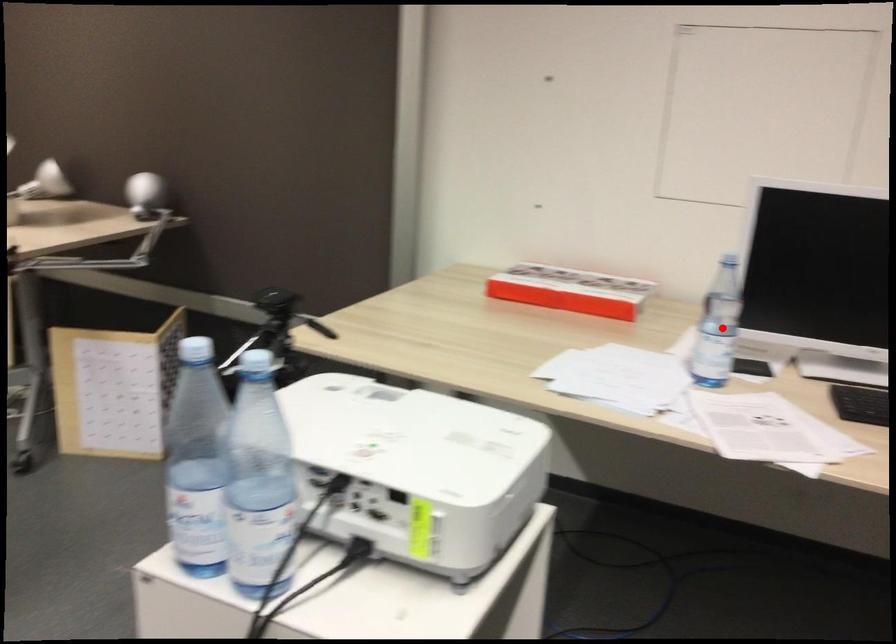
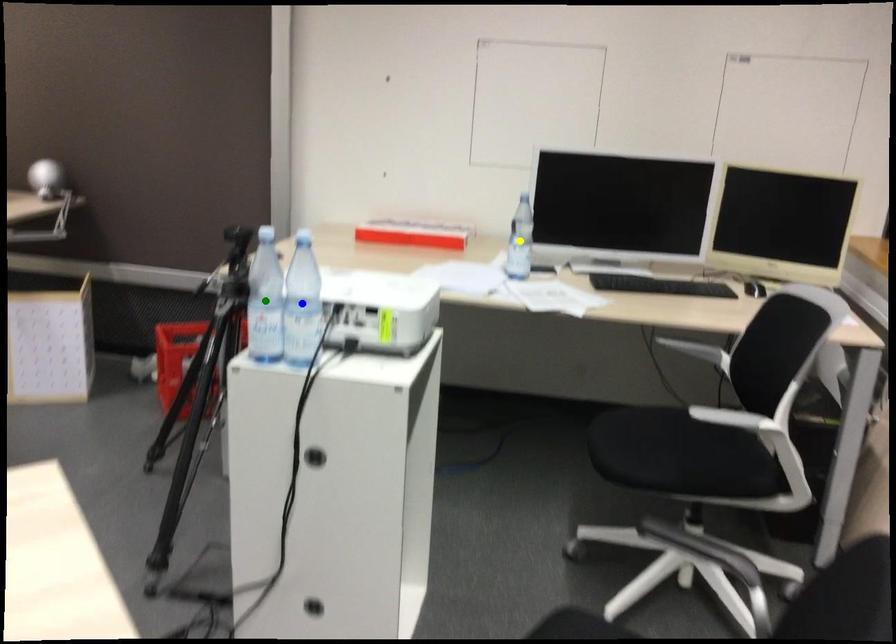
Question: I am providing you with two images of the same scene from different viewpoints. A red point is marked on the first image. You are given multiple points on the second image. Which point in image 2 represents the same 3d spot as the red point in image 1?

Choices:
 (A) green point
 (B) blue point
 (C) yellow point

Answer: (C)